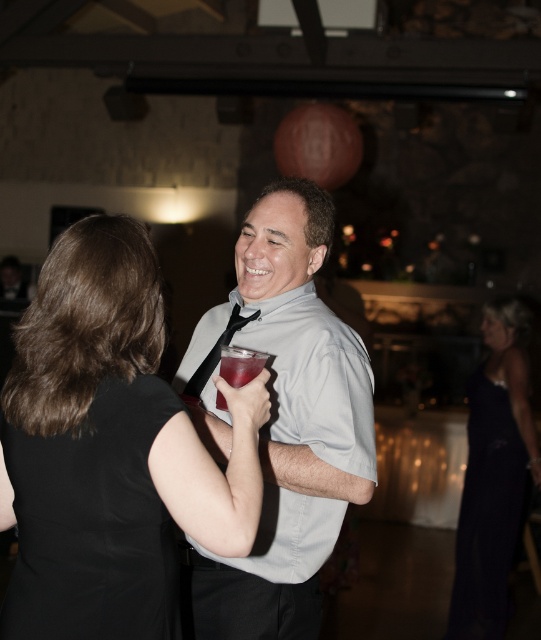
You are standing in the rustic venue and want to move from point A to point B. Point A is at coordinate point (497, 400) and point B is at coordinate point (195, 372). Since you can only move forward, will you be able to see point B while moving from point A to your current position? Please explain using the coordinates provided.

Point A at coordinate point (497, 400) is further to the viewer than point B at coordinate point (195, 372). This means that when moving from point A towards your current position, point B would be behind you and thus not visible in your forward direction.

You are standing at the entrance of the rustic indoor venue and see a person in a dark velvet dress at lower right. Can you estimate how far they are from the entrance based on their position at point (487, 513)?

The dark velvet dress at lower right is located at point (487, 513), which is close to the bottom right corner of the image, indicating they are near the entrance area. Therefore, they are likely about 2 meters away from the entrance.

You are a photographer at the event and need to adjust the lighting so that the dark velvet dress at lower right and the black satin tie at center are both visible. Since one is taller than the other, which object should you focus on first to ensure proper exposure?

The dark velvet dress at lower right is taller than the black satin tie at center, so you should focus on the dark velvet dress at lower right first to ensure proper exposure.